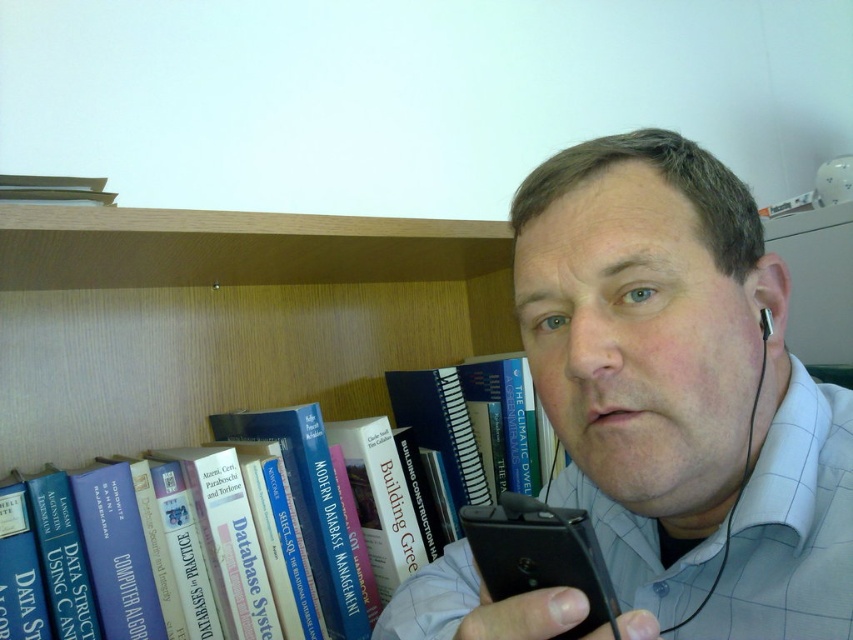
Question: Which of the following is the farthest from the observer?

Choices:
 (A) black plastic earphone at right
 (B) matte black phone at center
 (C) blue hardcover book at left
 (D) black plastic smartphone at lower center

Answer: (C)

Question: Is blue hardcover book at left to the left of black plastic earphone at right from the viewer's perspective?

Choices:
 (A) no
 (B) yes

Answer: (B)

Question: Can you confirm if matte black phone at center is wider than blue hardcover book at left?

Choices:
 (A) no
 (B) yes

Answer: (A)

Question: Does blue hardcover book at left appear under black plastic earphone at right?

Choices:
 (A) yes
 (B) no

Answer: (A)

Question: Among these objects, which one is nearest to the camera?

Choices:
 (A) black plastic smartphone at lower center
 (B) blue hardcover book at left

Answer: (A)

Question: Which of the following is the farthest from the observer?

Choices:
 (A) blue hardcover book at left
 (B) matte black phone at center
 (C) black plastic earphone at right

Answer: (A)